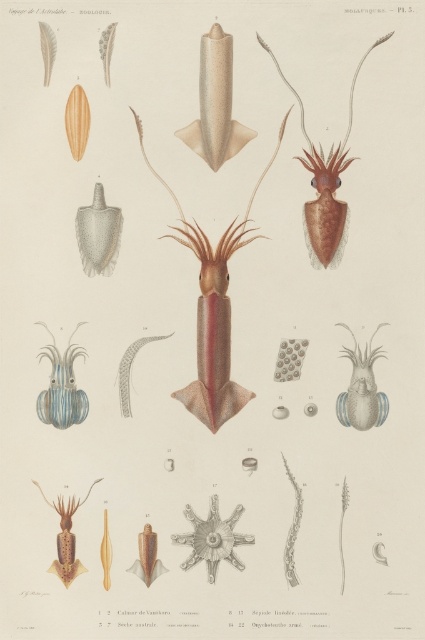
Question: Can you confirm if translucent blue squid at center is wider than blue striped squid at lower left?

Choices:
 (A) no
 (B) yes

Answer: (A)

Question: Which object appears closest to the camera in this image?

Choices:
 (A) translucent blue squid at center
 (B) matte brown squid at upper right

Answer: (A)

Question: Can you confirm if smooth brown squid at center is wider than translucent blue squid at center?

Choices:
 (A) no
 (B) yes

Answer: (B)

Question: Which object is the farthest from the translucent brown squid at center?

Choices:
 (A) matte brown squid at upper right
 (B) blue striped squid at lower left
 (C) translucent blue squid at center

Answer: (A)

Question: Does blue striped squid at lower left have a lesser width compared to translucent brown squid at center?

Choices:
 (A) no
 (B) yes

Answer: (B)

Question: Which point is closer to the camera?

Choices:
 (A) (51, 356)
 (B) (328, 173)
 (C) (64, 579)

Answer: (C)